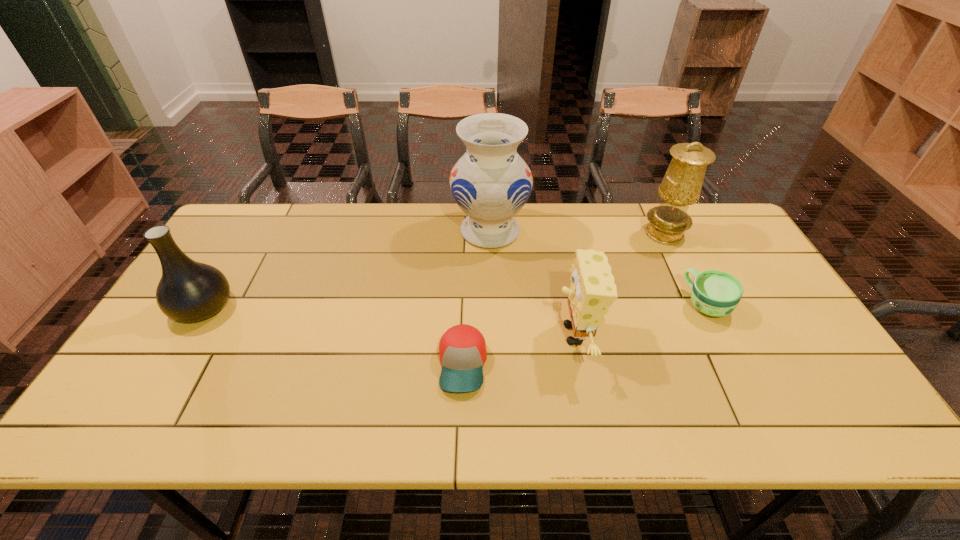
The height and width of the screenshot is (540, 960). Find the location of `free spot between the baseball cap and the leftmost object`. free spot between the baseball cap and the leftmost object is located at coordinates (333, 336).

At what (x,y) coordinates should I click in order to perform the action: click on object that is the third closest to the cup. Please return your answer as a coordinate pair (x, y). This screenshot has width=960, height=540. Looking at the image, I should click on (491, 183).

You are a GUI agent. You are given a task and a screenshot of the screen. Output one action in this format:
    pyautogui.click(x=<x>, y=<y>)
    Task: Click on the object that ranks as the second closest to the leftmost object
    The width and height of the screenshot is (960, 540).
    Given the screenshot: What is the action you would take?
    pyautogui.click(x=491, y=183)

Image resolution: width=960 pixels, height=540 pixels. Identify the location of vacant space that satisfies the following two spatial constraints: 1. on the front side of the fifth tallest object; 2. on the face of the sponge. (721, 334).

The height and width of the screenshot is (540, 960). Find the location of `vacant area that satisfies the following two spatial constraints: 1. on the face of the third object from right to left; 2. at the brim of the baseball cap`. vacant area that satisfies the following two spatial constraints: 1. on the face of the third object from right to left; 2. at the brim of the baseball cap is located at coordinates (581, 364).